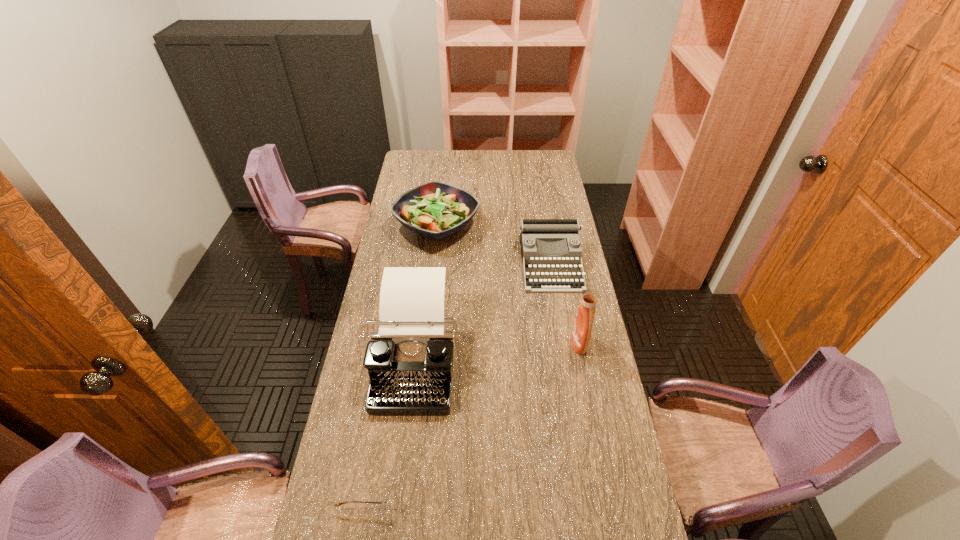
I want to click on vacant space located on the back of the salad plate, so click(x=444, y=168).

This screenshot has width=960, height=540. I want to click on free spot located on the typing side of the fourth tallest object, so click(561, 324).

Where is `typewriter present at the left edge`? This screenshot has width=960, height=540. typewriter present at the left edge is located at coordinates (409, 360).

Locate an element on the screen. salad plate located in the left edge section of the desktop is located at coordinates (436, 210).

Locate an element on the screen. The width and height of the screenshot is (960, 540). detergent at the right edge is located at coordinates (582, 328).

Identify the location of typewriter at the right edge. (532, 231).

This screenshot has height=540, width=960. In the image, there is a desktop. Find the location of `vacant space at the far edge`. vacant space at the far edge is located at coordinates (477, 157).

You are a GUI agent. You are given a task and a screenshot of the screen. Output one action in this format:
    pyautogui.click(x=<x>, y=<y>)
    Task: Click on the vacant space at the left edge
    This screenshot has width=960, height=540.
    Given the screenshot: What is the action you would take?
    pyautogui.click(x=404, y=232)

You are a GUI agent. You are given a task and a screenshot of the screen. Output one action in this format:
    pyautogui.click(x=<x>, y=<y>)
    Task: Click on the free spot at the right edge of the desktop
    The width and height of the screenshot is (960, 540).
    Given the screenshot: What is the action you would take?
    point(557,386)

Locate an element on the screen. The height and width of the screenshot is (540, 960). vacant position at the far left corner of the desktop is located at coordinates (432, 152).